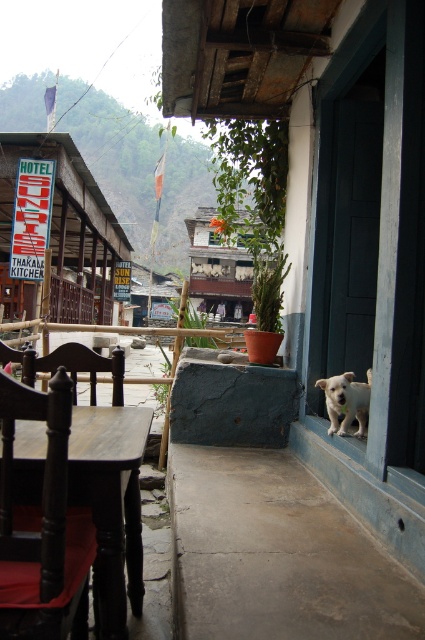
In the scene shown: You are a person who is 1.8 meters tall. You are standing at the smooth concrete porch at lower center and want to walk to the dark brown wooden table at lower left. Can you walk directly to it without bending down?

The distance between the smooth concrete porch at lower center and the dark brown wooden table at lower left is 71.71 centimeters. Since this distance is shorter than your height, you can walk directly to it without needing to bend down.

You are standing at the entrance of the building and want to place a small potted plant on the smooth concrete porch at lower center. However, there is already a white fur dog at lower right nearby. Based on their positions, can you confirm if the dog is on the same side as the porch relative to the doorway?

The smooth concrete porch at lower center is to the left of white fur dog at lower right, so the dog is on the right side relative to the porch. Since the porch is at the entrance, the dog is positioned to the right of the porch, meaning they are on opposite sides relative to the doorway.

You are setting up a small garden party and need to place a 1.2 meter wide picnic blanket. Based on the scene, can you determine if the smooth concrete porch at lower center can accommodate the picnic blanket without overlapping the dark brown wooden table at lower left?

The smooth concrete porch at lower center might be wider than the dark brown wooden table at lower left, so there is a possibility that the porch can accommodate the 1.2 meter wide picnic blanket without overlapping the table. However, the exact dimensions are uncertain based on the provided information.